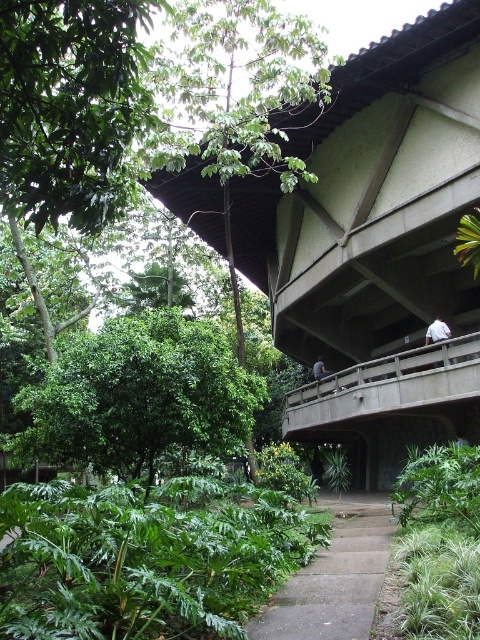
Between green leafy tree at center and dark gray fabric at upper center, which one appears on the left side from the viewer's perspective?

green leafy tree at center

Is point (254, 378) less distant than point (324, 374)?

Yes.

Does point (98, 412) come farther from viewer compared to point (319, 364)?

That is False.

Where is `green leafy tree at center`? green leafy tree at center is located at coordinates (139, 396).

Does concrete gray bridge at center have a larger size compared to dark gray fabric at upper center?

Yes.

Who is higher up, concrete gray bridge at center or dark gray fabric at upper center?

Positioned higher is dark gray fabric at upper center.

Based on the photo, who is more distant from viewer, (469, 380) or (324, 365)?

The point (324, 365) is behind.

You are a GUI agent. You are given a task and a screenshot of the screen. Output one action in this format:
    pyautogui.click(x=<x>, y=<y>)
    Task: Click on the concrete gray bridge at center
    The height and width of the screenshot is (640, 480).
    Given the screenshot: What is the action you would take?
    pyautogui.click(x=384, y=388)

Can you confirm if gray concrete path at center is taller than concrete gray bridge at center?

Incorrect, gray concrete path at center's height is not larger of concrete gray bridge at center's.

The width and height of the screenshot is (480, 640). What do you see at coordinates (335, 579) in the screenshot?
I see `gray concrete path at center` at bounding box center [335, 579].

Locate an element on the screen. gray concrete path at center is located at coordinates (335, 579).